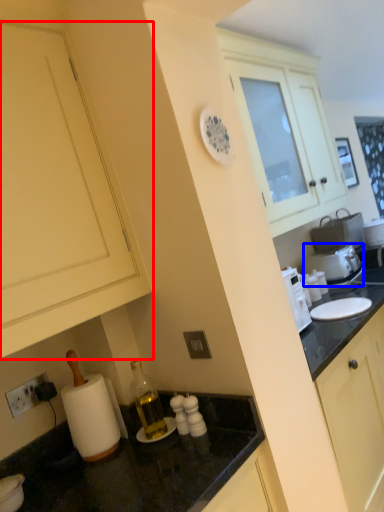
Question: Among these objects, which one is nearest to the camera, cabinetry (highlighted by a red box) or appliance (highlighted by a blue box)?

Choices:
 (A) cabinetry
 (B) appliance

Answer: (A)